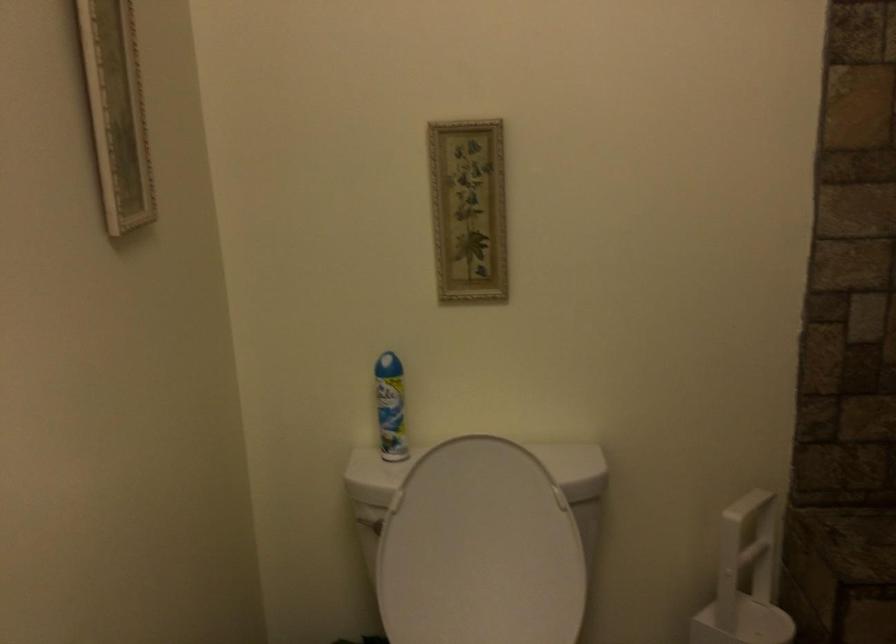
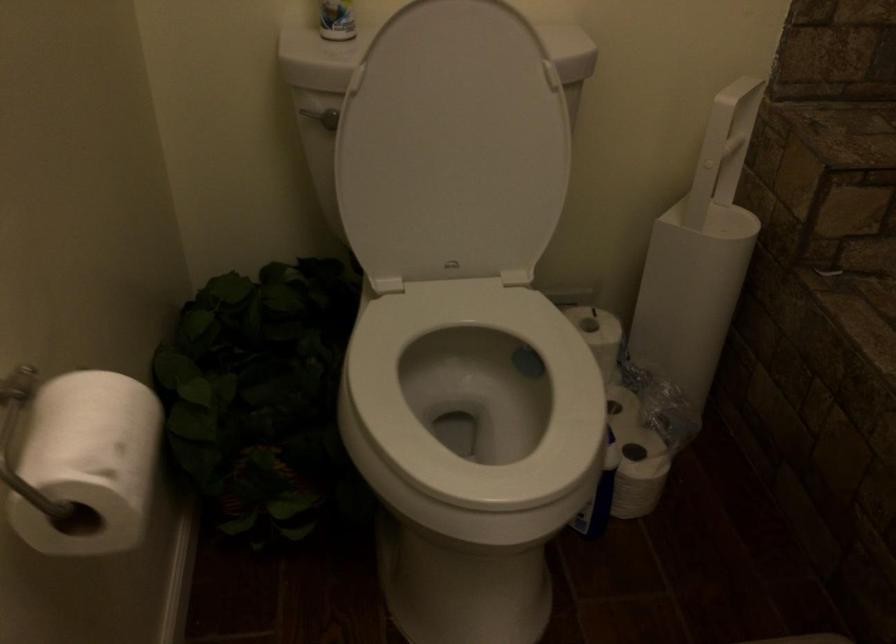
Question: Based on the continuous images, in which direction is the camera rotating? Reply with the corresponding letter.

Choices:
 (A) Left
 (B) Right
 (C) Up
 (D) Down

Answer: (D)